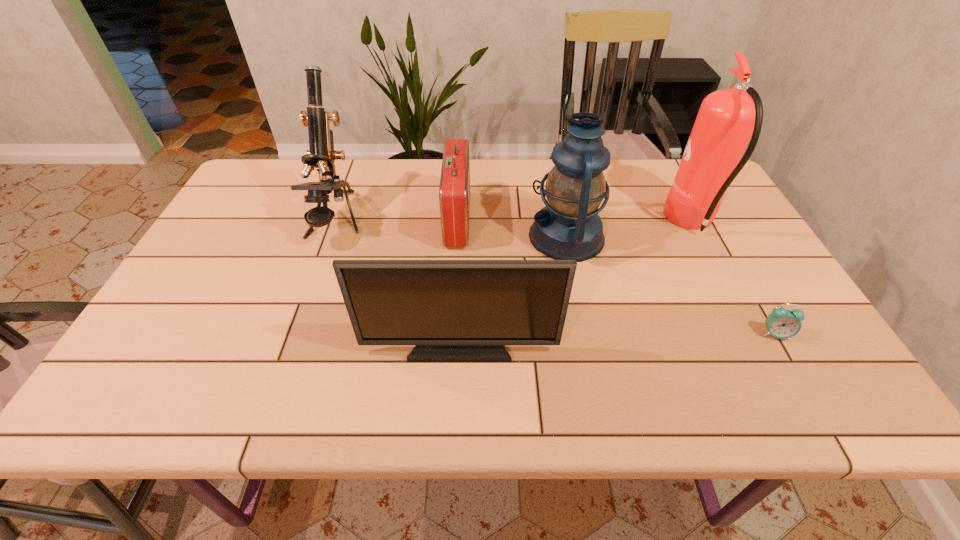
The image size is (960, 540). Identify the location of alarm clock that is positioned at the right edge. (781, 323).

I want to click on object at the far right corner, so click(x=727, y=119).

Where is `free space at the far edge of the desktop`? The image size is (960, 540). free space at the far edge of the desktop is located at coordinates (660, 197).

Identify the location of blank space at the near edge. (496, 403).

Find the location of a particular element. vacant space at the left edge of the desktop is located at coordinates [207, 271].

In the image, there is a desktop. Where is `free space at the far left corner`? The image size is (960, 540). free space at the far left corner is located at coordinates (252, 186).

I want to click on free space at the near right corner of the desktop, so click(x=839, y=406).

At what (x,y) coordinates should I click in order to perform the action: click on free point between the microscope and the fire extinguisher. Please return your answer as a coordinate pair (x, y). Looking at the image, I should click on (515, 222).

Find the location of a particular element. free point between the lantern and the alarm clock is located at coordinates (671, 285).

The width and height of the screenshot is (960, 540). Identify the location of free space between the fire extinguisher and the microscope. (515, 222).